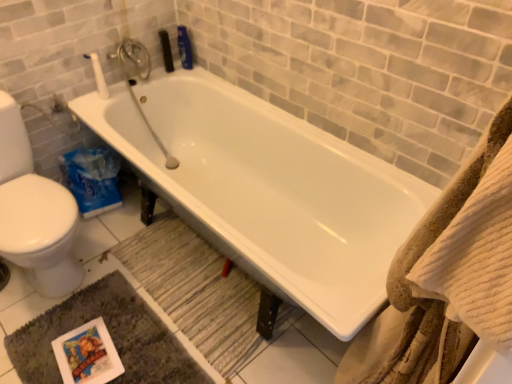
Question: Does point (96, 79) appear closer or farther from the camera than point (106, 327)?

Choices:
 (A) farther
 (B) closer

Answer: (A)

Question: Considering the positions of white matte toilet paper at upper left and dark gray plush bath mat at lower left, which ranks as the second bath mat in top-to-bottom order, in the image, is white matte toilet paper at upper left bigger or smaller than dark gray plush bath mat at lower left, which ranks as the second bath mat in top-to-bottom order,?

Choices:
 (A) small
 (B) big

Answer: (A)

Question: Considering the real-world distances, which object is closest to the dark gray plush bath mat at lower left, arranged as the first bath mat when ordered from the bottom?

Choices:
 (A) white glossy bathtub at center
 (B) white matte toilet paper at upper left
 (C) white textured towel at right
 (D) wooden textured bath mat at lower center, which is the first bath mat in top-to-bottom order

Answer: (D)

Question: Which object is the closest to the dark gray plush bath mat at lower left, which ranks as the second bath mat in top-to-bottom order?

Choices:
 (A) white glossy bathtub at center
 (B) wooden textured bath mat at lower center, which is counted as the 2th bath mat, starting from the bottom
 (C) white textured towel at right
 (D) white matte toilet paper at upper left

Answer: (B)